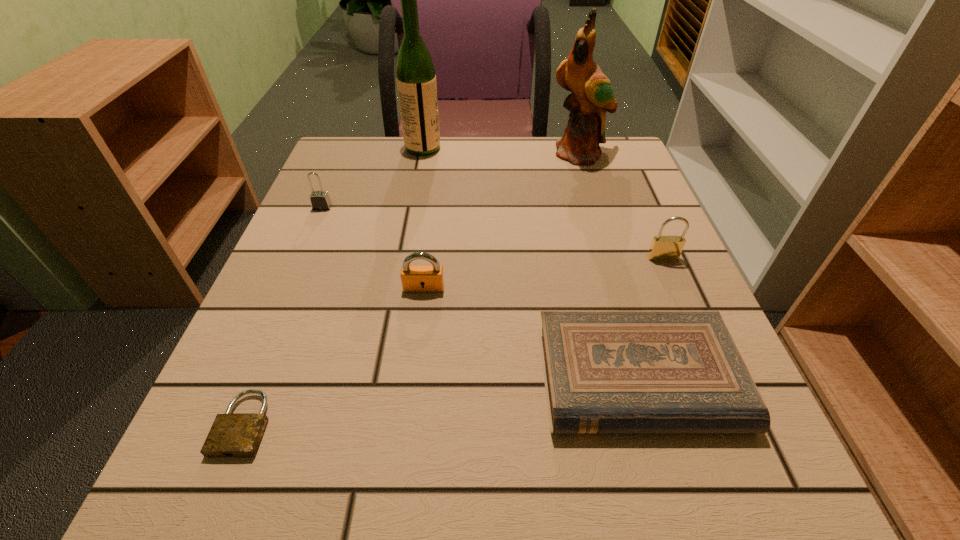
I want to click on padlock that is at the right edge, so click(663, 248).

The height and width of the screenshot is (540, 960). I want to click on Bible located in the right edge section of the desktop, so click(x=604, y=371).

Image resolution: width=960 pixels, height=540 pixels. In order to click on object positioned at the near left corner in this screenshot , I will do (x=232, y=434).

This screenshot has width=960, height=540. What are the coordinates of `object at the far right corner` in the screenshot? It's located at (592, 95).

In the image, there is a desktop. Where is `free space at the far edge`? free space at the far edge is located at coordinates (539, 160).

The image size is (960, 540). Identify the location of free space at the near edge of the desktop. (512, 473).

What are the coordinates of `free space at the left edge` in the screenshot? It's located at (305, 239).

The width and height of the screenshot is (960, 540). In the image, there is a desktop. What are the coordinates of `vacant space at the right edge` in the screenshot? It's located at (667, 438).

Image resolution: width=960 pixels, height=540 pixels. In the image, there is a desktop. In order to click on vacant space at the far left corner in this screenshot , I will do `click(355, 178)`.

In the image, there is a desktop. At what (x,y) coordinates should I click in order to perform the action: click on vacant space at the far right corner. Please return your answer as a coordinate pair (x, y). The height and width of the screenshot is (540, 960). Looking at the image, I should click on [618, 141].